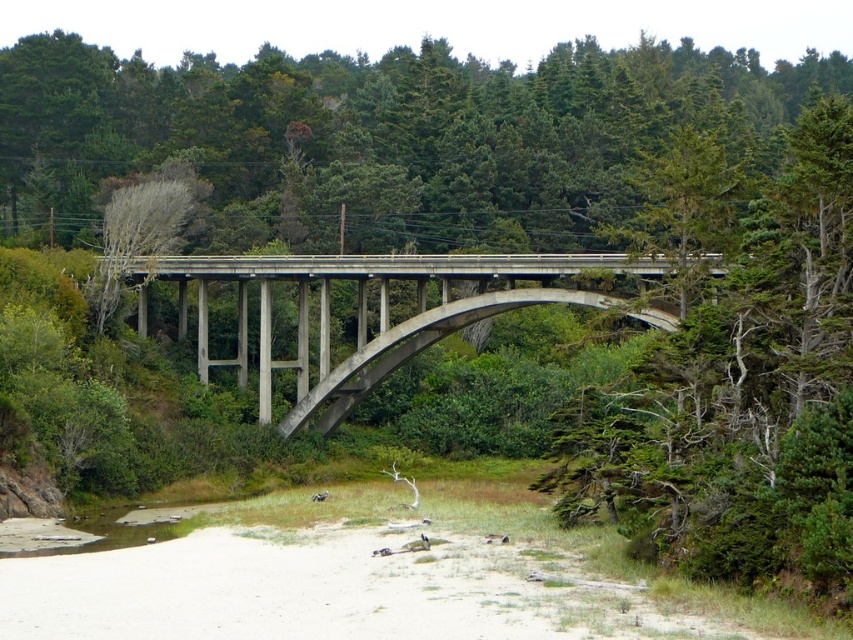
Question: Among these objects, which one is nearest to the camera?

Choices:
 (A) concrete bridge at center
 (B) brown sedimentary river at lower left

Answer: (B)

Question: Does concrete bridge at center appear on the left side of brown sedimentary river at lower left?

Choices:
 (A) no
 (B) yes

Answer: (A)

Question: Does concrete bridge at center appear over brown sedimentary river at lower left?

Choices:
 (A) yes
 (B) no

Answer: (A)

Question: Among these objects, which one is farthest from the camera?

Choices:
 (A) concrete bridge at center
 (B) brown sedimentary river at lower left

Answer: (A)

Question: Is concrete bridge at center to the left of brown sedimentary river at lower left from the viewer's perspective?

Choices:
 (A) no
 (B) yes

Answer: (A)